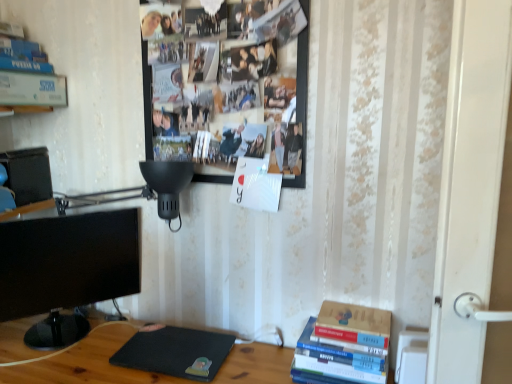
Question: In terms of width, does black glossy monitor at left look wider or thinner when compared to hardcover books at lower right?

Choices:
 (A) thin
 (B) wide

Answer: (A)

Question: Is black glossy monitor at left to the left or to the right of hardcover books at lower right in the image?

Choices:
 (A) right
 (B) left

Answer: (B)

Question: Which is nearer to the brown cardboard book at lower right, placed as the first paperback book when sorted from bottom to top?

Choices:
 (A) black glossy monitor at left
 (B) black matte laptop at lower center
 (C) hardcover books at lower right
 (D) white matte paperback book at upper left, which ranks as the 1th paperback book in back-to-front order
 (E) wooden photo frame at upper center

Answer: (C)

Question: Considering the real-world distances, which object is closest to the brown cardboard book at lower right, which ranks as the second paperback book in left-to-right order?

Choices:
 (A) black matte laptop at lower center
 (B) white matte paperback book at upper left, which ranks as the second paperback book in bottom-to-top order
 (C) black glossy monitor at left
 (D) hardcover books at lower right
 (E) wooden photo frame at upper center

Answer: (D)